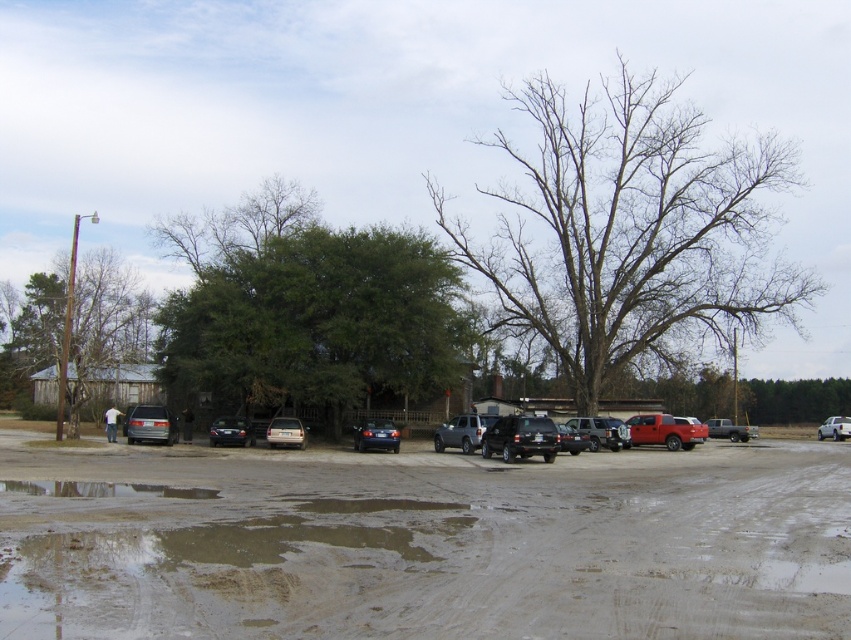
Does matte black truck at center appear under satin black sedan at center?

Correct, matte black truck at center is located below satin black sedan at center.

At what (x,y) coordinates should I click in order to perform the action: click on matte black truck at center. Please return your answer as a coordinate pair (x, y). Image resolution: width=851 pixels, height=640 pixels. Looking at the image, I should click on (601, 432).

Where is `matte black truck at center`? The width and height of the screenshot is (851, 640). matte black truck at center is located at coordinates (601, 432).

Can you confirm if satin black suv at center is taller than satin blue sedan at center?

In fact, satin black suv at center may be shorter than satin blue sedan at center.

Between point (533, 444) and point (393, 424), which one is positioned in front?

Point (533, 444) is more forward.

The width and height of the screenshot is (851, 640). In order to click on satin black suv at center in this screenshot , I will do 520,436.

Can you confirm if green leafy tree at center is shorter than satin silver suv at center?

No, green leafy tree at center is not shorter than satin silver suv at center.

Identify the location of green leafy tree at center. This screenshot has height=640, width=851. (320, 323).

Locate an element on the screen. This screenshot has height=640, width=851. green leafy tree at center is located at coordinates (320, 323).